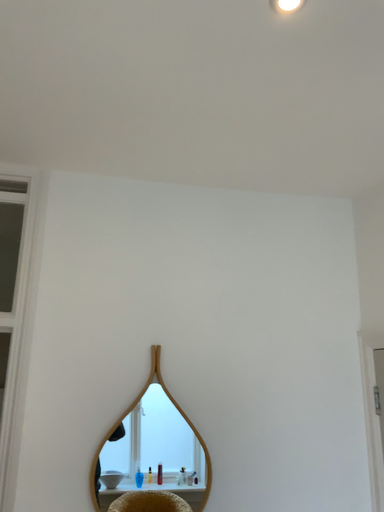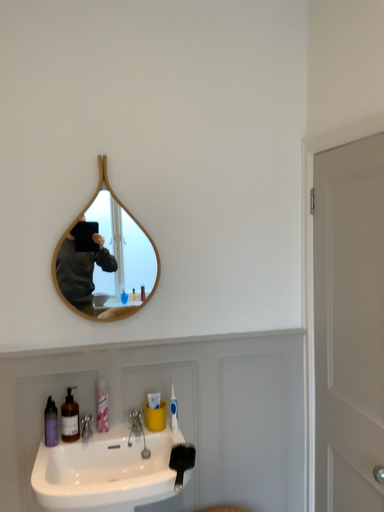
Question: Which way did the camera rotate in the video?

Choices:
 (A) rotated upward
 (B) rotated downward

Answer: (B)